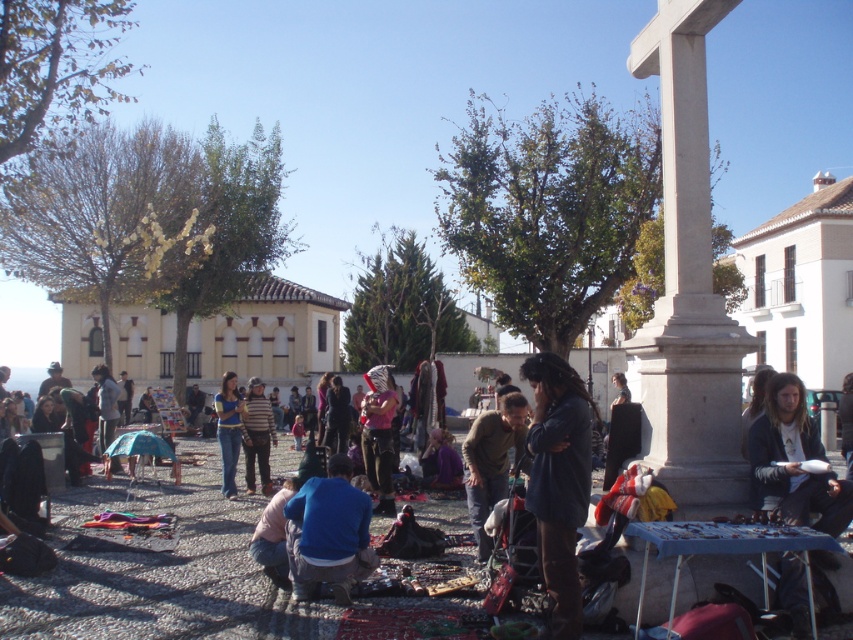
Is dark blue denim jacket at center further to camera compared to matte pink shirt at center?

No, dark blue denim jacket at center is closer to the viewer.

Does point (544, 541) come behind point (380, 476)?

No, (544, 541) is closer to viewer.

Between point (550, 618) and point (384, 461), which one is positioned behind?

Point (384, 461)

I want to click on dark blue denim jacket at center, so click(x=558, y=481).

Does blue cotton shirt at center have a lesser height compared to striped knit sweater at center?

Indeed, blue cotton shirt at center has a lesser height compared to striped knit sweater at center.

Which is below, blue cotton shirt at center or striped knit sweater at center?

striped knit sweater at center is lower down.

At what (x,y) coordinates should I click in order to perform the action: click on blue cotton shirt at center. Please return your answer as a coordinate pair (x, y). This screenshot has height=640, width=853. Looking at the image, I should click on (328, 532).

This screenshot has width=853, height=640. Identify the location of blue cotton shirt at center. (328, 532).

Looking at this image, between dark blue denim jacket at center and striped knit sweater at center, which one appears on the right side from the viewer's perspective?

dark blue denim jacket at center is more to the right.

Does point (579, 488) come farther from viewer compared to point (256, 428)?

No, (579, 488) is in front of (256, 428).

Identify the location of dark blue denim jacket at center. The height and width of the screenshot is (640, 853). (558, 481).